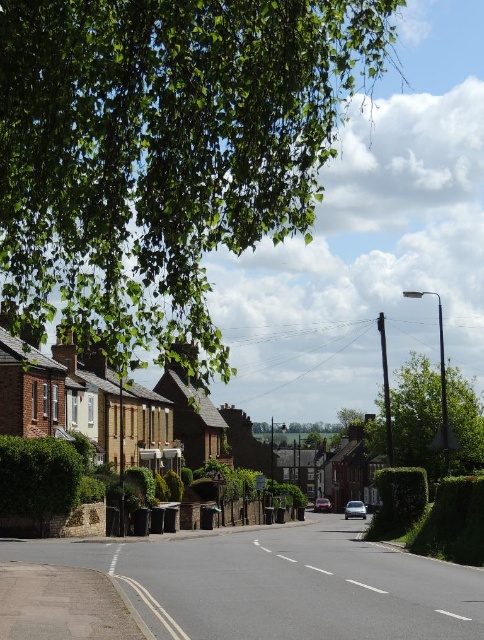
Question: Is metallic silver car at center behind white plastic street sign at center?

Choices:
 (A) no
 (B) yes

Answer: (B)

Question: Can you confirm if silver metallic car at center is thinner than metallic silver car at center?

Choices:
 (A) yes
 (B) no

Answer: (B)

Question: Does metallic silver car at center lie behind white plastic street sign at center?

Choices:
 (A) yes
 (B) no

Answer: (A)

Question: Which of the following is the closest to the observer?

Choices:
 (A) (x=466, y=452)
 (B) (x=255, y=477)
 (C) (x=184, y=314)
 (D) (x=346, y=518)

Answer: (C)

Question: Which of the following is the closest to the observer?

Choices:
 (A) (407, 458)
 (B) (284, 186)

Answer: (B)

Question: Among these points, which one is nearest to the camera?

Choices:
 (A) (211, 138)
 (B) (347, 508)
 (C) (475, 397)
 (D) (256, 476)

Answer: (A)